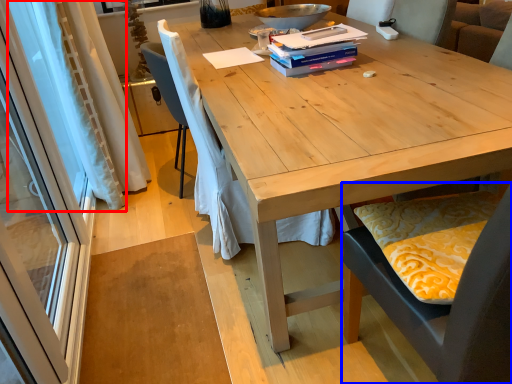
Question: Which of the following is the closest to the observer, curtain (highlighted by a red box) or chair (highlighted by a blue box)?

Choices:
 (A) curtain
 (B) chair

Answer: (B)